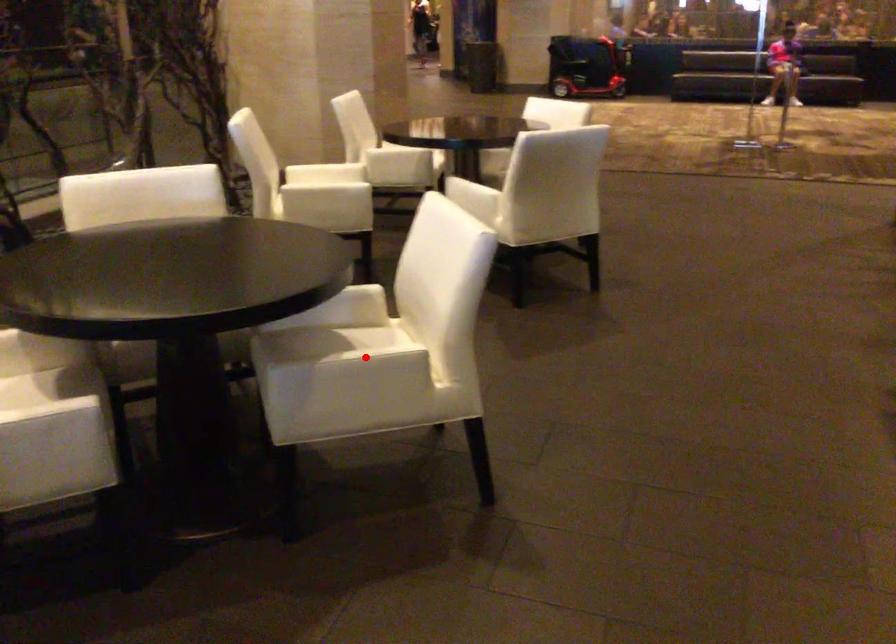
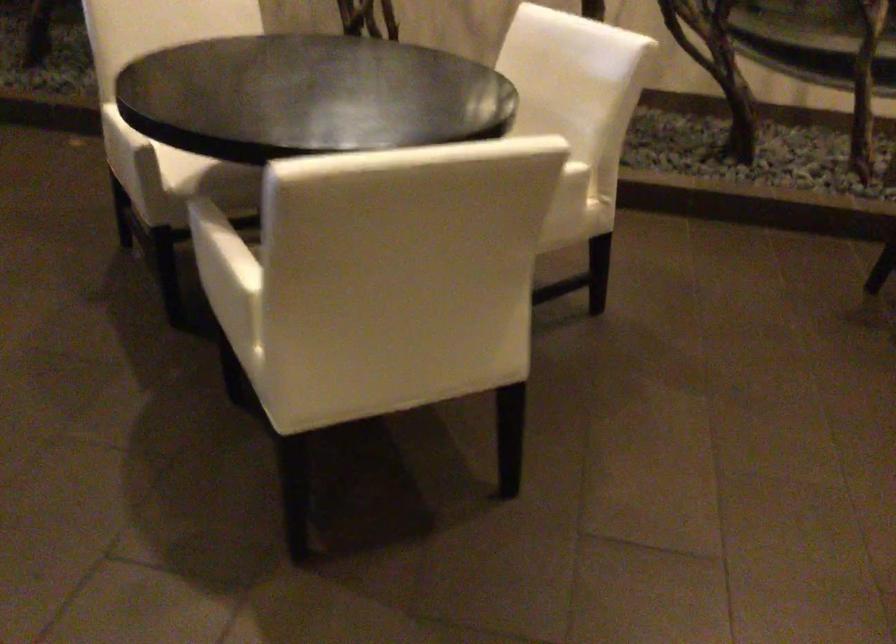
Question: I am providing you with two images of the same scene from different viewpoints. Given a red point in image1, look at the same physical point in image2. Is it:

Choices:
 (A) Closer to the viewpoint
 (B) Farther from the viewpoint

Answer: (A)